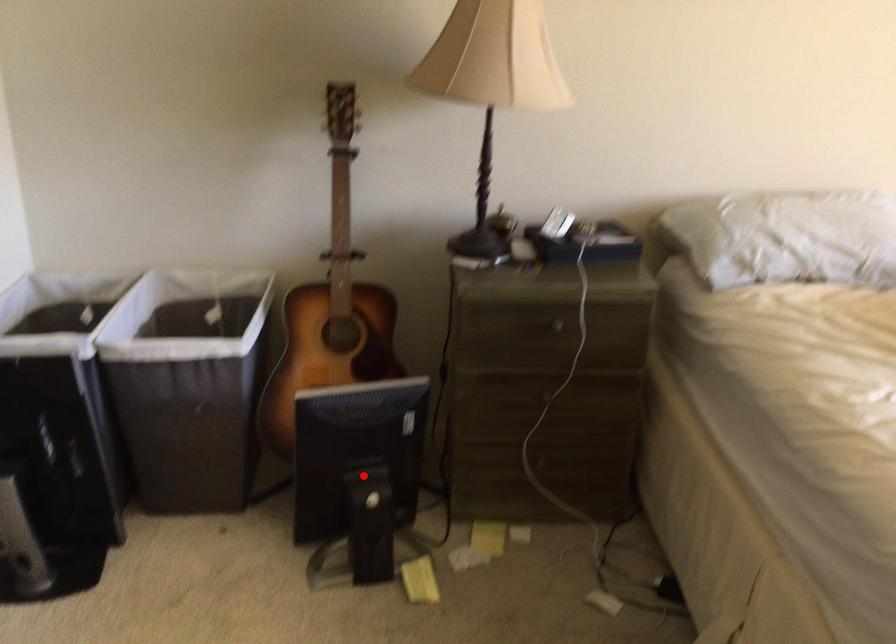
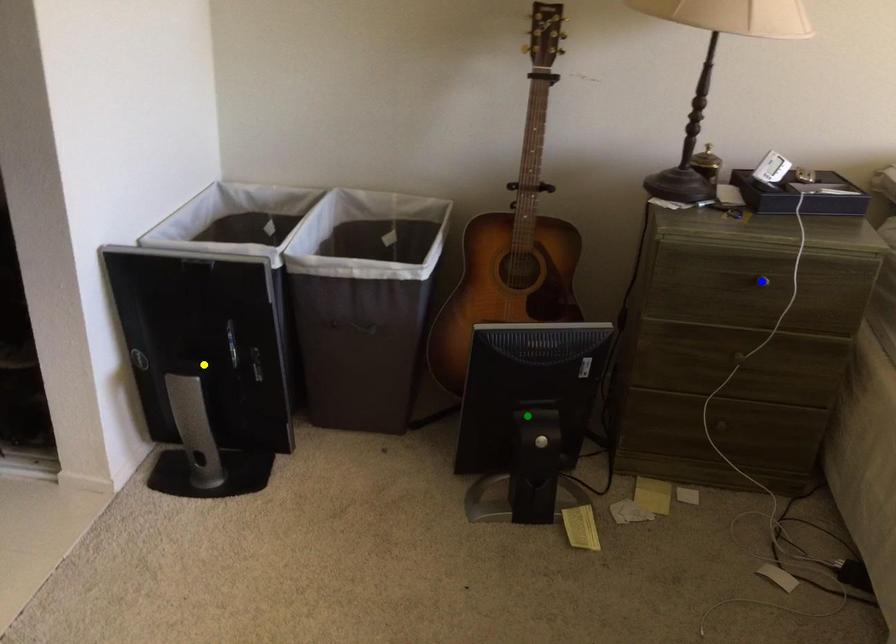
Question: I am providing you with two images of the same scene from different viewpoints. A red point is marked on the first image. You are given multiple points on the second image. In image 2, which mark is for the same physical point as the one in image 1?

Choices:
 (A) yellow point
 (B) blue point
 (C) green point

Answer: (C)